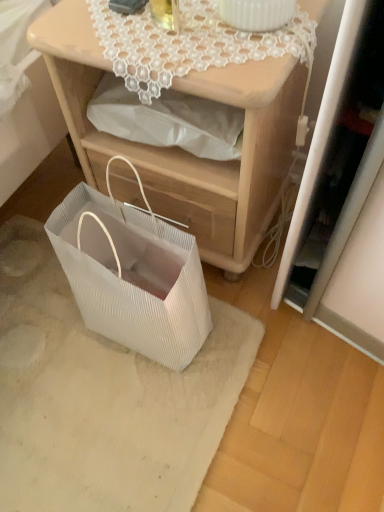
Question: From a real-world perspective, is matte wood nightstand at center positioned under white textured mat at lower left based on gravity?

Choices:
 (A) no
 (B) yes

Answer: (A)

Question: Is white textured mat at lower left at the back of matte wood nightstand at center?

Choices:
 (A) yes
 (B) no

Answer: (B)

Question: Is matte wood nightstand at center taller than white textured mat at lower left?

Choices:
 (A) yes
 (B) no

Answer: (A)

Question: Is matte wood nightstand at center touching white textured mat at lower left?

Choices:
 (A) yes
 (B) no

Answer: (B)

Question: Does matte wood nightstand at center have a larger size compared to white textured mat at lower left?

Choices:
 (A) no
 (B) yes

Answer: (B)

Question: Is matte wood nightstand at center behind white textured mat at lower left?

Choices:
 (A) yes
 (B) no

Answer: (B)

Question: Can you confirm if white lace doily at upper center is smaller than white textured mat at lower left?

Choices:
 (A) yes
 (B) no

Answer: (A)

Question: Can you confirm if white lace doily at upper center is positioned to the right of white textured mat at lower left?

Choices:
 (A) yes
 (B) no

Answer: (A)

Question: Can you confirm if white lace doily at upper center is thinner than white textured mat at lower left?

Choices:
 (A) yes
 (B) no

Answer: (A)

Question: Is white lace doily at upper center oriented away from white textured mat at lower left?

Choices:
 (A) no
 (B) yes

Answer: (A)

Question: From the image's perspective, is white lace doily at upper center located beneath white textured mat at lower left?

Choices:
 (A) yes
 (B) no

Answer: (B)

Question: Can you confirm if white lace doily at upper center is wider than white textured mat at lower left?

Choices:
 (A) no
 (B) yes

Answer: (A)

Question: Does white lace doily at upper center have a greater height compared to white pleated paper bag at lower left?

Choices:
 (A) yes
 (B) no

Answer: (B)